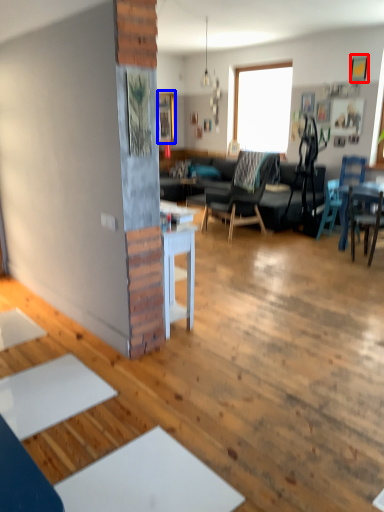
Question: Which of the following is the closest to the observer, picture frame (highlighted by a red box) or picture frame (highlighted by a blue box)?

Choices:
 (A) picture frame
 (B) picture frame

Answer: (A)